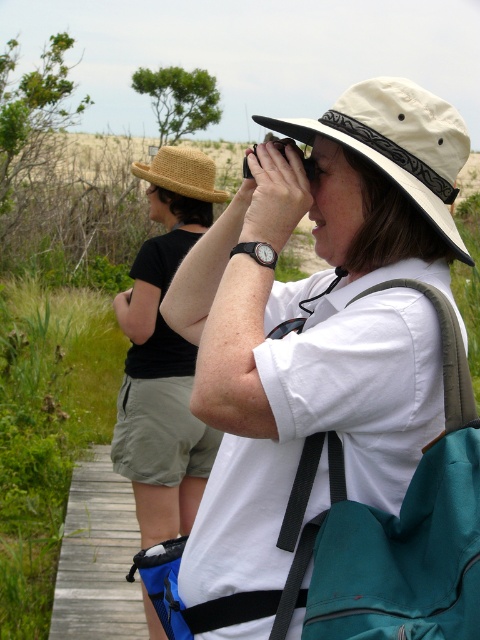
You are trying to locate the teal fabric backpack at center and the straw hat at upper left in the image. Based on their positions, which object is closer to the right side of the image?

The teal fabric backpack at center is closer to the right side of the image because it is positioned to the right of the straw hat at upper left.